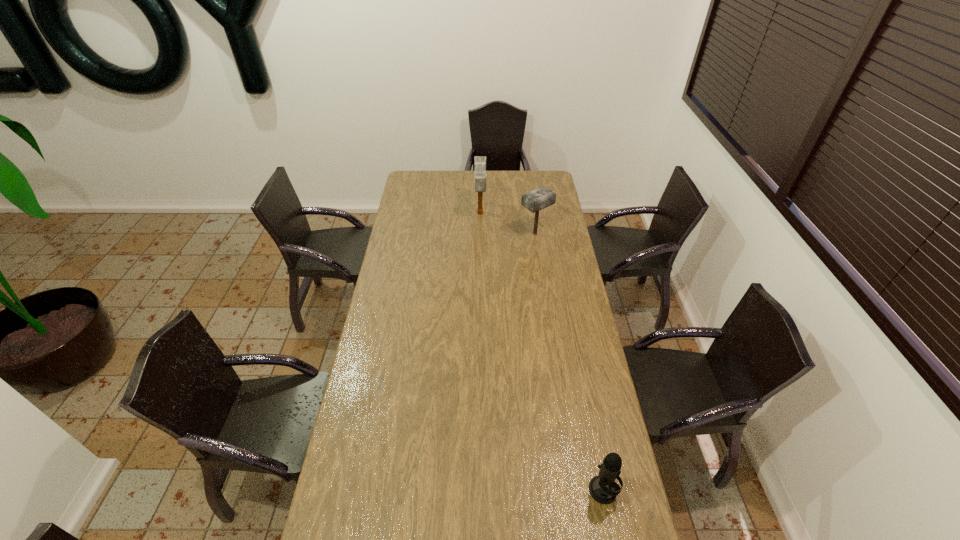
The height and width of the screenshot is (540, 960). I want to click on vacant area between the left mallet and the right mallet, so click(x=508, y=224).

Where is `empty space between the leftmost object and the right mallet`? The image size is (960, 540). empty space between the leftmost object and the right mallet is located at coordinates (508, 224).

Identify the location of vacant area that lies between the right mallet and the leftmost object. (508, 224).

Choose which object is the nearest neighbor to the leftmost object. Please provide its 2D coordinates. Your answer should be formatted as a tuple, i.e. [(x, y)], where the tuple contains the x and y coordinates of a point satisfying the conditions above.

[(538, 199)]

Where is `the second closest object to the left mallet`? the second closest object to the left mallet is located at coordinates (603, 488).

This screenshot has height=540, width=960. I want to click on vacant space that satisfies the following two spatial constraints: 1. on the front side of the nearest object; 2. on the right side of the left mallet, so click(x=480, y=490).

The height and width of the screenshot is (540, 960). I want to click on vacant region that satisfies the following two spatial constraints: 1. on the front side of the leftmost object; 2. on the right side of the right mallet, so click(480, 234).

Locate an element on the screen. vacant space that satisfies the following two spatial constraints: 1. on the front side of the shortest object; 2. on the left side of the leftmost object is located at coordinates click(480, 490).